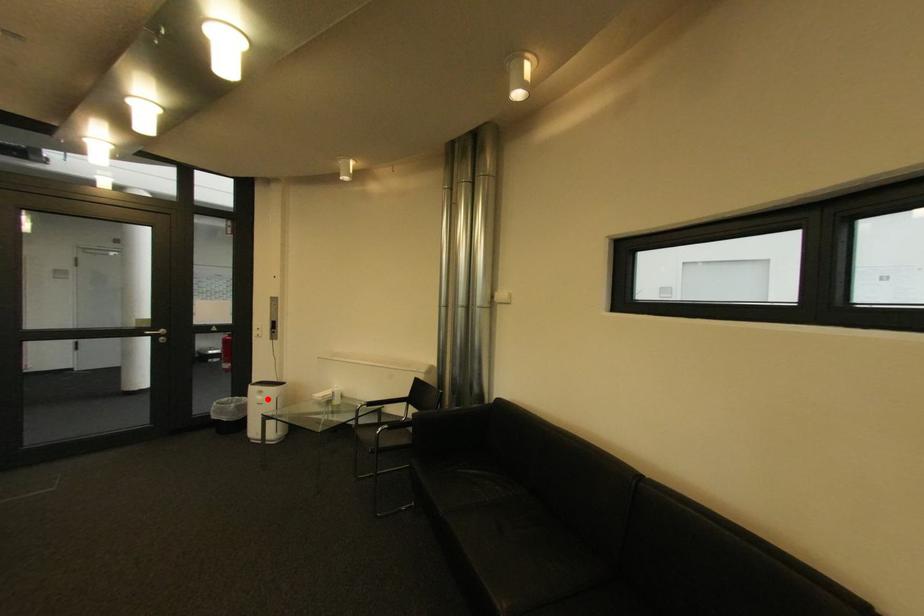
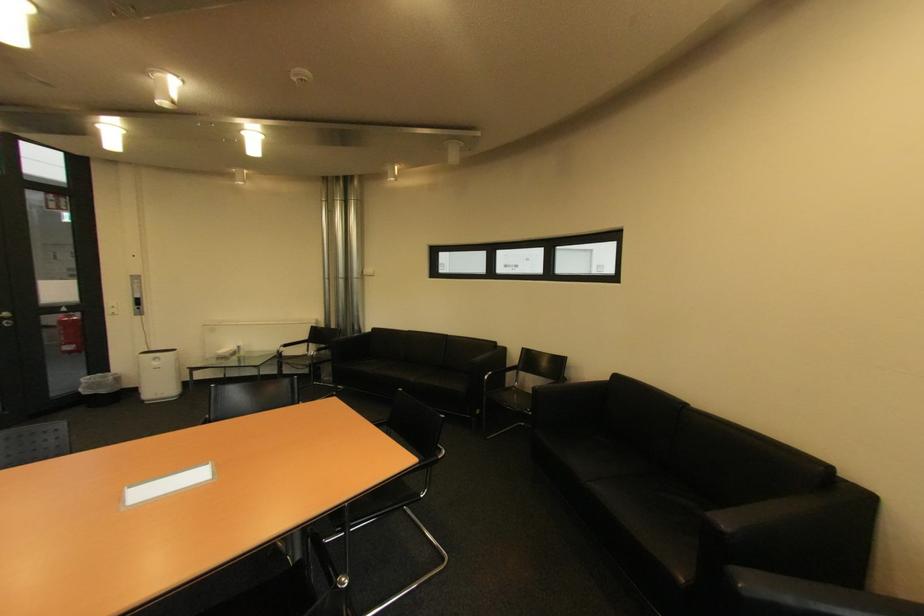
Question: I am providing you with two images of the same scene from different viewpoints. In image1, a red point is highlighted. Considering the same 3D point in image2, which of the following is correct?

Choices:
 (A) It is closer
 (B) It is farther

Answer: (A)